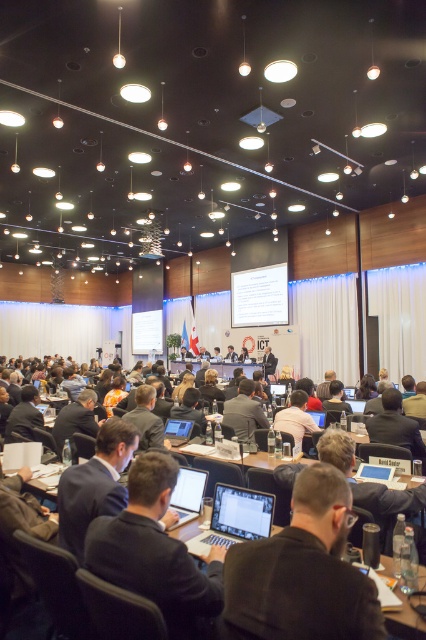
Question: Which object is the closest to the dark brown suit at center?

Choices:
 (A) matte black laptop at center
 (B) dark blue suit at center
 (C) black suit at lower left

Answer: (A)

Question: Is black matte laptop at center positioned before matte black laptop at center?

Choices:
 (A) no
 (B) yes

Answer: (B)

Question: Based on their relative distances, which object is nearer to the black fabric chair at center?

Choices:
 (A) dark brown leather jacket at center
 (B) dark blue suit at center
 (C) matte black laptop at center

Answer: (B)

Question: Is dark suit at lower left below black suit at lower left?

Choices:
 (A) no
 (B) yes

Answer: (A)

Question: Which object appears farthest from the camera in this image?

Choices:
 (A) dark suit at lower left
 (B) matte black suit at center
 (C) dark blue suit at center
 (D) black matte laptop at center

Answer: (B)

Question: Is the position of dark suit at lower left more distant than that of dark brown suit at center?

Choices:
 (A) yes
 (B) no

Answer: (B)